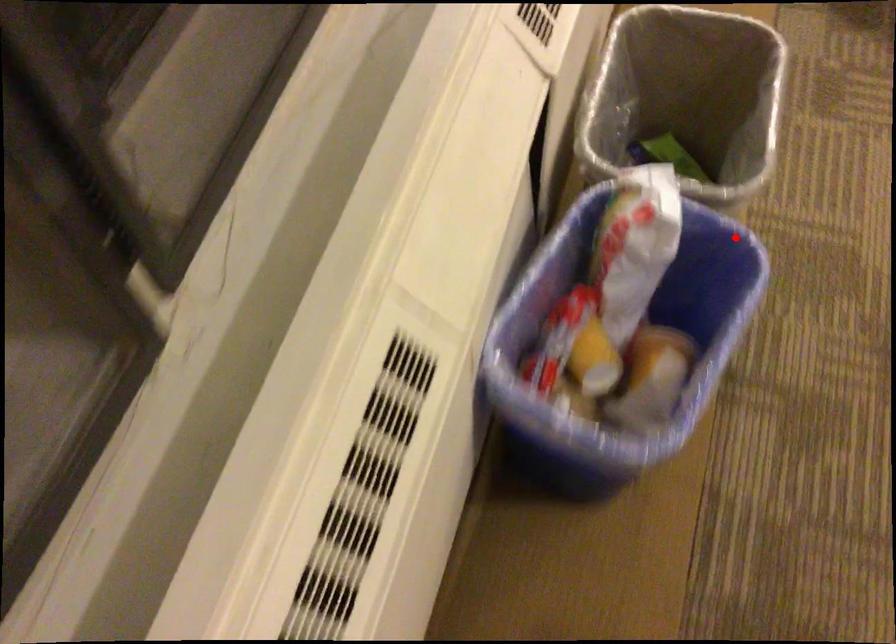
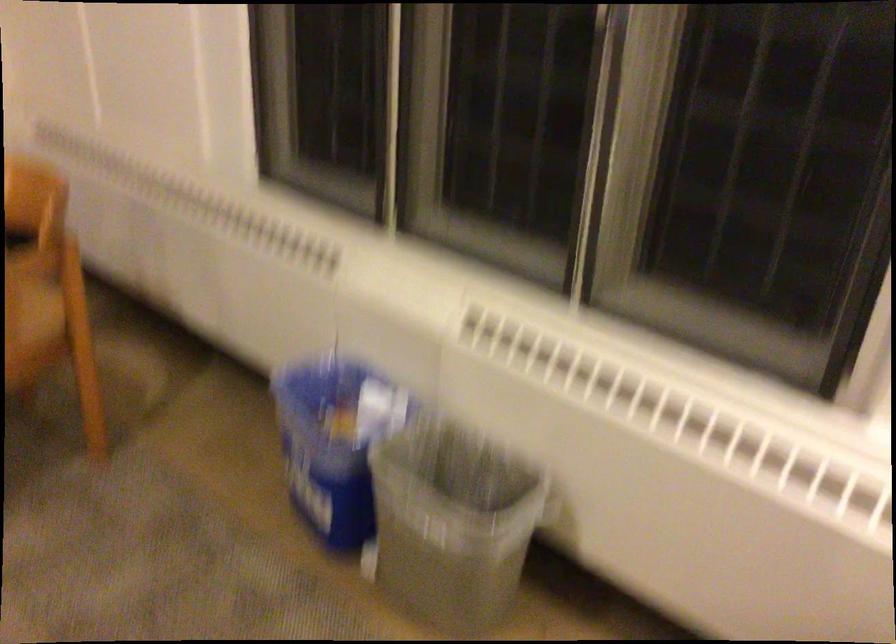
Question: I am providing you with two images of the same scene from different viewpoints. Given a red point in image1, look at the same physical point in image2. Is it:

Choices:
 (A) Closer to the viewpoint
 (B) Farther from the viewpoint

Answer: (B)